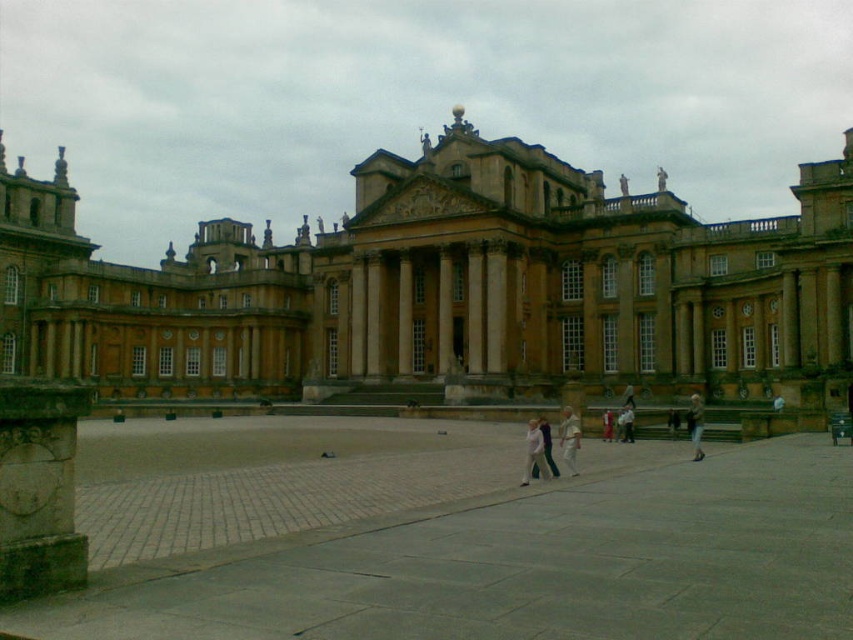
You are attending a formal event and see both the light beige fabric dress at center and the light beige fabric pants at center in the grand historic building. Which clothing item is closer to you?

The light beige fabric dress at center is closer to you because it is in front of the light beige fabric fabric pants at center.

You are an architect visiting this historic building and need to compare the height of the carved stone pillar at lower left and the light beige fabric dress at center. Which object is taller?

The carved stone pillar at lower left is taller than the light beige fabric dress at center.